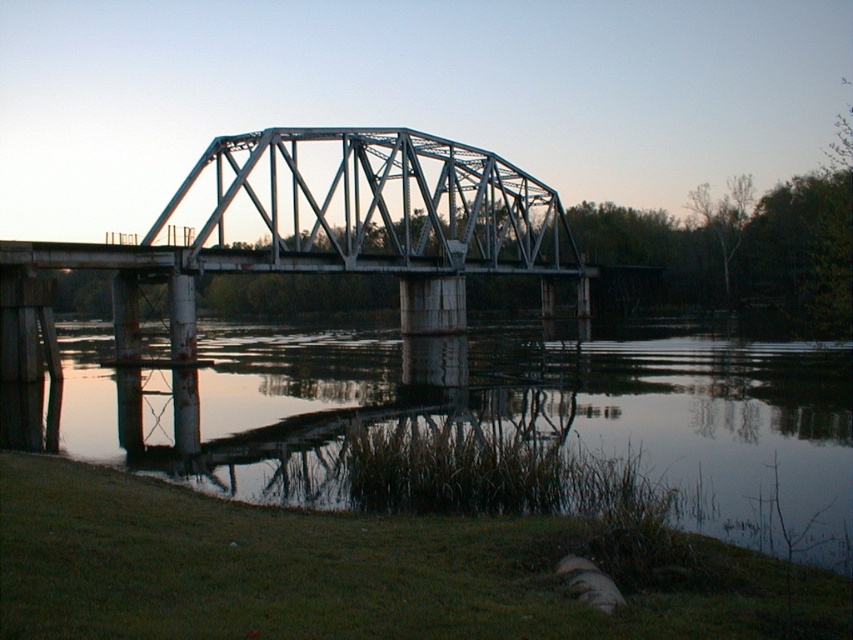
Question: In this image, where is smooth reflective water at lower center located relative to metallic gray bridge at center?

Choices:
 (A) above
 (B) below

Answer: (B)

Question: Which point appears farthest from the camera in this image?

Choices:
 (A) (103, 401)
 (B) (213, 161)

Answer: (B)

Question: Among these points, which one is farthest from the camera?

Choices:
 (A) (199, 248)
 (B) (103, 456)

Answer: (A)

Question: Can you confirm if smooth reflective water at lower center is positioned to the right of metallic gray bridge at center?

Choices:
 (A) yes
 (B) no

Answer: (A)

Question: Which point is closer to the camera taking this photo?

Choices:
 (A) (339, 170)
 (B) (421, 352)

Answer: (A)

Question: Is the position of smooth reflective water at lower center less distant than that of metallic gray bridge at center?

Choices:
 (A) no
 (B) yes

Answer: (B)